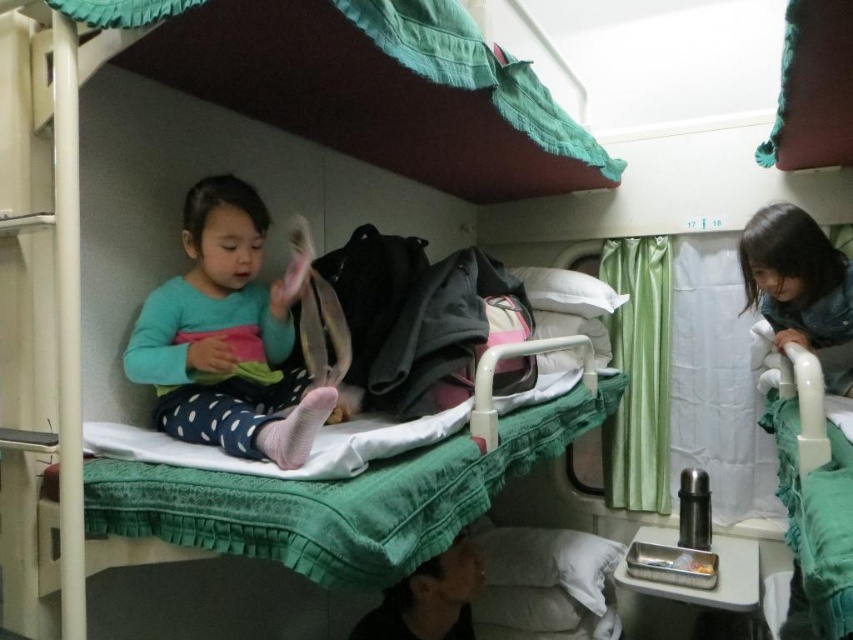
Question: Does matte teal shirt at center have a smaller size compared to green satin curtain at right?

Choices:
 (A) yes
 (B) no

Answer: (B)

Question: Is green satin curtain at right below smooth denim jacket at upper right?

Choices:
 (A) no
 (B) yes

Answer: (B)

Question: Estimate the real-world distances between objects in this image. Which object is closer to the matte teal shirt at center?

Choices:
 (A) smooth denim jacket at upper right
 (B) green satin curtain at right

Answer: (A)

Question: Which of these objects is positioned farthest from the smooth denim jacket at upper right?

Choices:
 (A) green satin curtain at right
 (B) matte teal shirt at center

Answer: (B)

Question: Is matte teal shirt at center to the left of smooth denim jacket at upper right from the viewer's perspective?

Choices:
 (A) yes
 (B) no

Answer: (A)

Question: Among these points, which one is farthest from the camera?

Choices:
 (A) (834, 314)
 (B) (229, 397)
 (C) (639, 355)

Answer: (C)